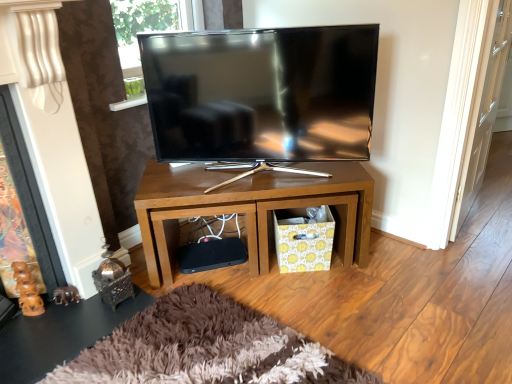
Identify the location of vacant space that is to the left of polished metal lantern at lower left. Image resolution: width=512 pixels, height=384 pixels. (73, 308).